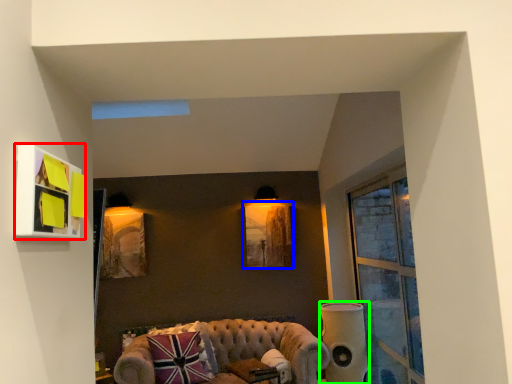
Question: Which object is the closest to the picture frame (highlighted by a red box)? Choose among these: picture frame (highlighted by a blue box) or speaker (highlighted by a green box).

Choices:
 (A) picture frame
 (B) speaker

Answer: (B)